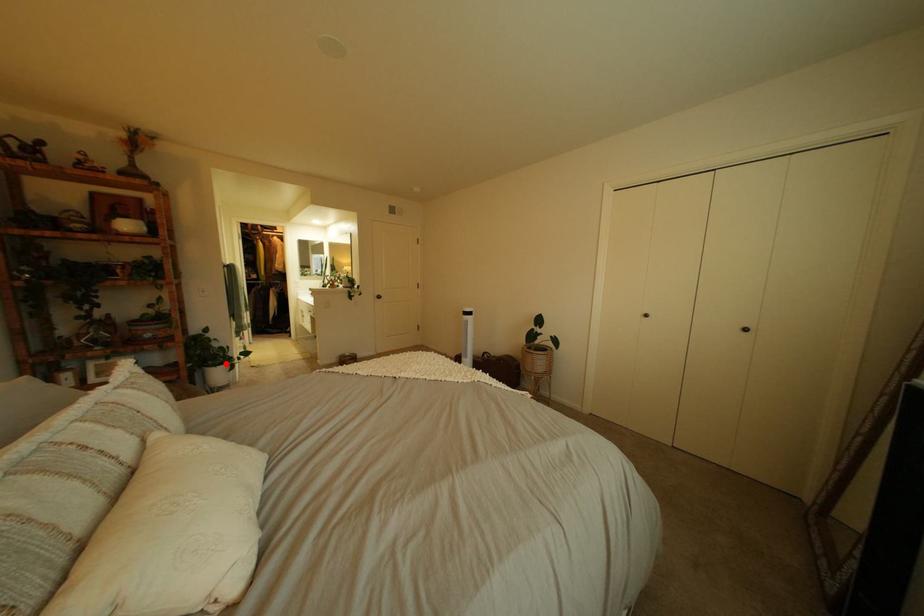
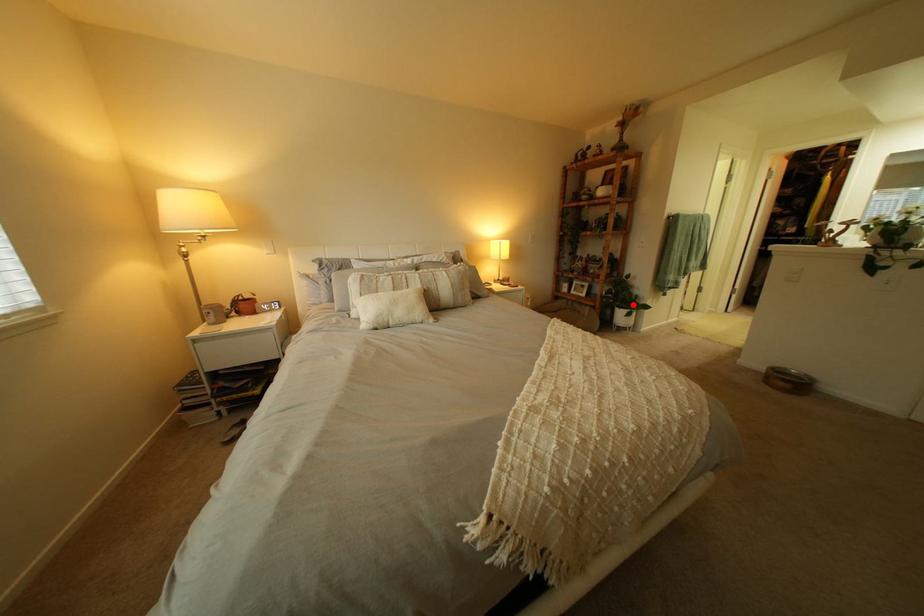
I am providing you with two images of the same scene from different viewpoints. A red point is marked on the first image and another point is marked on the second image. Is the red point in image1 aligned with the point shown in image2?

Yes